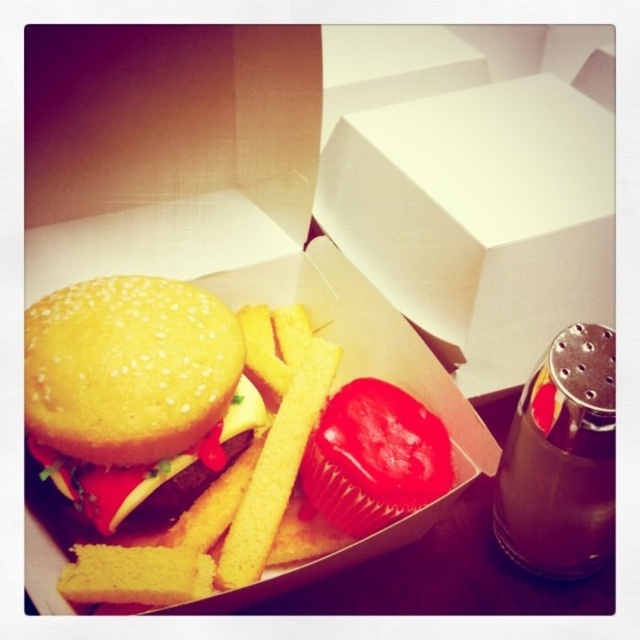
Between white cardboard box at center and semi-glossy yellow bun at center, which one has more height?

With more height is white cardboard box at center.

Can you confirm if white cardboard box at center is taller than semi-glossy yellow bun at center?

Yes, white cardboard box at center is taller than semi-glossy yellow bun at center.

Where is `white cardboard box at center`? The image size is (640, 640). white cardboard box at center is located at coordinates [x=481, y=216].

I want to click on white cardboard box at center, so click(481, 216).

Consider the image. Does yellow crispy french fries at center have a greater width compared to black plastic salt shaker at right?

Indeed, yellow crispy french fries at center has a greater width compared to black plastic salt shaker at right.

Between point (305, 324) and point (584, 371), which one is positioned behind?

Point (305, 324)

The width and height of the screenshot is (640, 640). In order to click on yellow crispy french fries at center in this screenshot , I will do `click(230, 484)`.

Between semi-glossy yellow bun at center and black plastic salt shaker at right, which one appears on the right side from the viewer's perspective?

black plastic salt shaker at right is more to the right.

Which is in front, point (138, 422) or point (604, 360)?

Positioned in front is point (604, 360).

Locate an element on the screen. This screenshot has width=640, height=640. semi-glossy yellow bun at center is located at coordinates (131, 388).